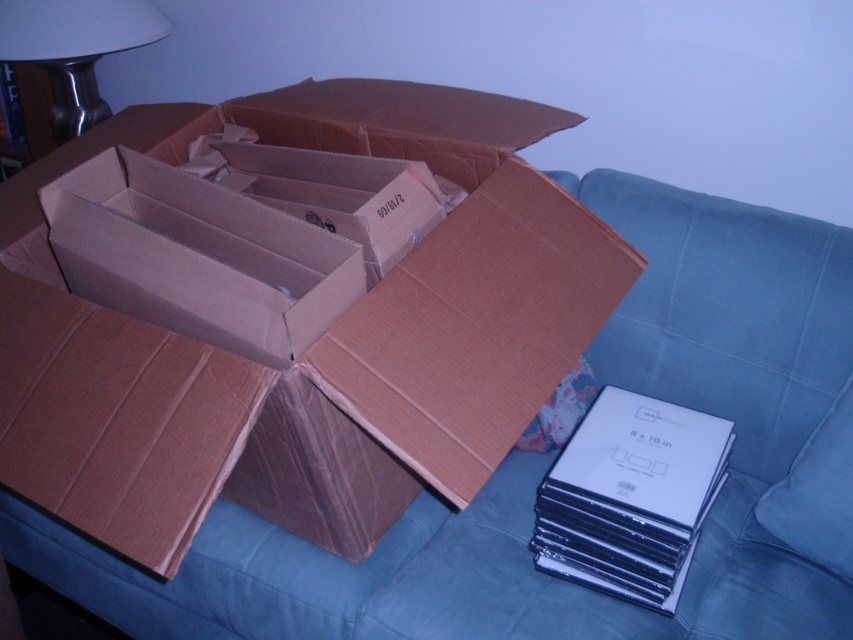
Question: Which point is farther to the camera?

Choices:
 (A) brown corrugated cardboard box at center
 (B) white matte lampshade at upper left

Answer: (B)

Question: Is brown corrugated cardboard box at center bigger than white matte lampshade at upper left?

Choices:
 (A) no
 (B) yes

Answer: (B)

Question: Does brown corrugated cardboard box at center have a smaller size compared to white matte lampshade at upper left?

Choices:
 (A) no
 (B) yes

Answer: (A)

Question: Is brown corrugated cardboard box at center positioned at the back of white matte lampshade at upper left?

Choices:
 (A) yes
 (B) no

Answer: (B)